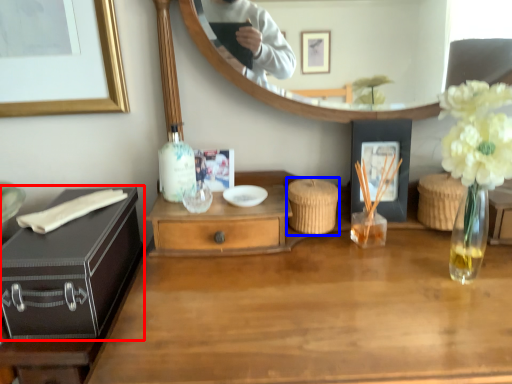
Question: Which object appears closest to the camera in this image, chest (highlighted by a red box) or picnic basket (highlighted by a blue box)?

Choices:
 (A) chest
 (B) picnic basket

Answer: (A)